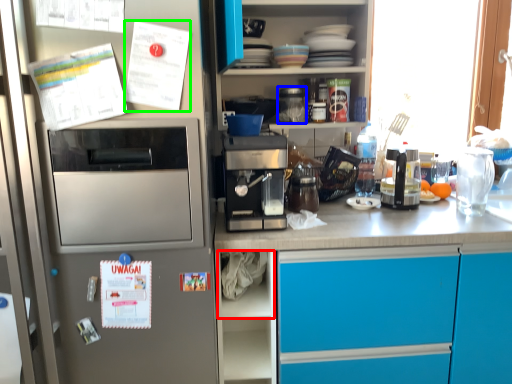
Question: Which is farther away from shelf (highlighted by a red box)? appliance (highlighted by a blue box) or postcard (highlighted by a green box)?

Choices:
 (A) appliance
 (B) postcard

Answer: (B)